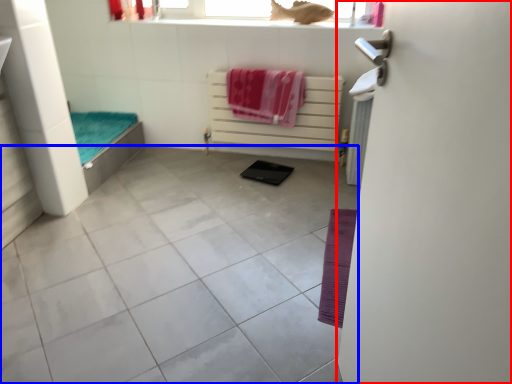
Question: Among these objects, which one is farthest to the camera, screen door (highlighted by a red box) or ceramic tile (highlighted by a blue box)?

Choices:
 (A) screen door
 (B) ceramic tile

Answer: (B)